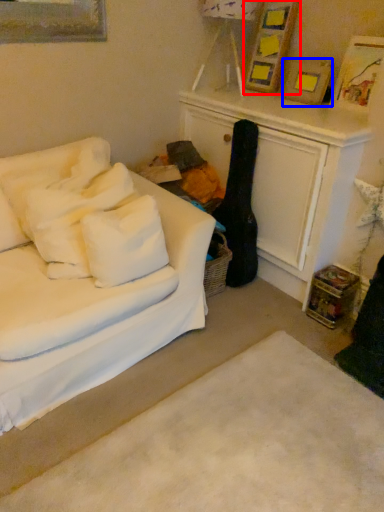
Question: Which of the following is the closest to the observer, picture frame (highlighted by a red box) or picture frame (highlighted by a blue box)?

Choices:
 (A) picture frame
 (B) picture frame

Answer: (B)